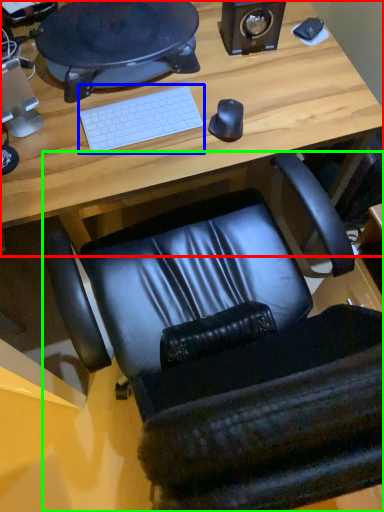
Question: Based on their relative distances, which object is nearer to desk (highlighted by a red box)? Choose from computer keyboard (highlighted by a blue box) and chair (highlighted by a green box).

Choices:
 (A) computer keyboard
 (B) chair

Answer: (A)